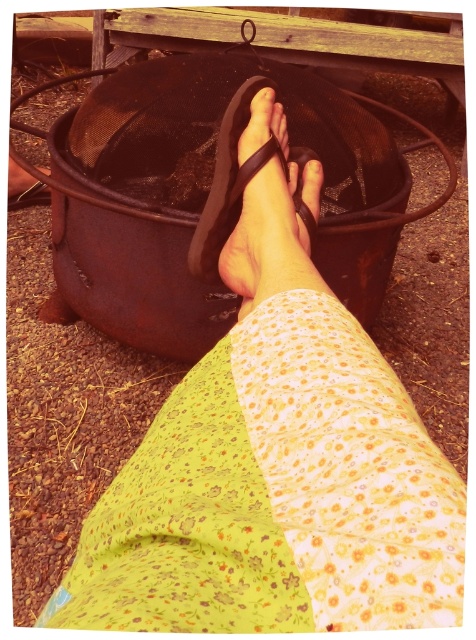
Is point (221, 150) positioned before point (289, 177)?

That is True.

Is point (228, 189) farther from viewer compared to point (291, 176)?

That is False.

Where is `black rubber sandal at center`? This screenshot has width=476, height=640. black rubber sandal at center is located at coordinates (228, 180).